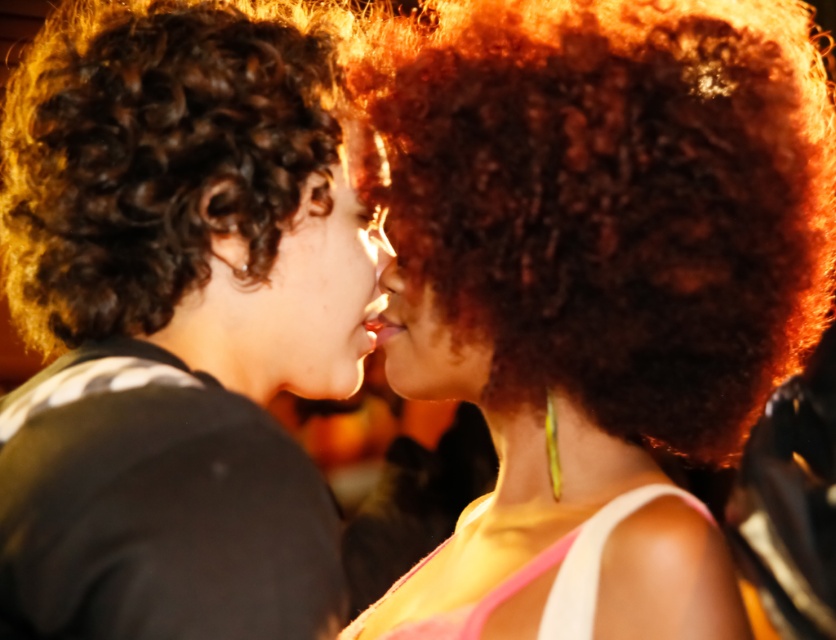
Question: Which object is closer to the camera taking this photo?

Choices:
 (A) matte black shirt at center
 (B) shiny brown hair at center
 (C) smooth skin face at center

Answer: (A)

Question: Estimate the real-world distances between objects in this image. Which object is farther from the matte black shirt at center?

Choices:
 (A) shiny brown hair at center
 (B) smooth skin face at center

Answer: (A)

Question: In this image, where is shiny brown hair at center located relative to matte black shirt at center?

Choices:
 (A) above
 (B) below

Answer: (A)

Question: Is the position of matte black shirt at center more distant than that of smooth skin face at center?

Choices:
 (A) no
 (B) yes

Answer: (A)

Question: In this image, where is matte black shirt at center located relative to smooth skin face at center?

Choices:
 (A) below
 (B) above

Answer: (A)

Question: Estimate the real-world distances between objects in this image. Which object is farther from the smooth skin face at center?

Choices:
 (A) matte black shirt at center
 (B) shiny brown hair at center

Answer: (B)